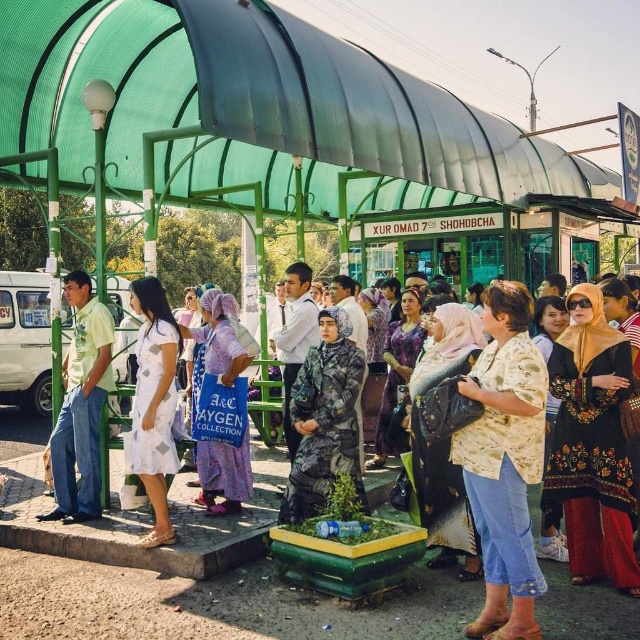
You are a photographer standing at the bus stop. You want to take a photo of both the light green shirt at center and the white printed dress at center in the same frame. Can you fit both subjects into the photo without moving your position? Please explain your answer based on their distance apart.

The light green shirt at center and the white printed dress at center are 36.96 inches apart from each other. Since 36.96 inches is approximately 3.08 feet, which is a manageable distance for a standard camera lens, you can likely fit both subjects into the photo without moving your position.

You are a photographer at the bus stop under the green canopy. You notice two people in the crowd wearing a white printed dress at center and a camouflage uniform at center. Which one is positioned more to the left?

The white printed dress at center is positioned more to the left than the camouflage uniform at center.

From the picture: You are a photographer at the bus stop and want to capture both the light green shirt at center and the white printed dress at center in the same frame. Which one should you position your camera closer to in order to include both subjects?

To include both the light green shirt at center and the white printed dress at center in the same frame, position your camera closer to the light green shirt at center since it is to the left of the white printed dress at center, allowing you to capture both by adjusting the angle or zoom.